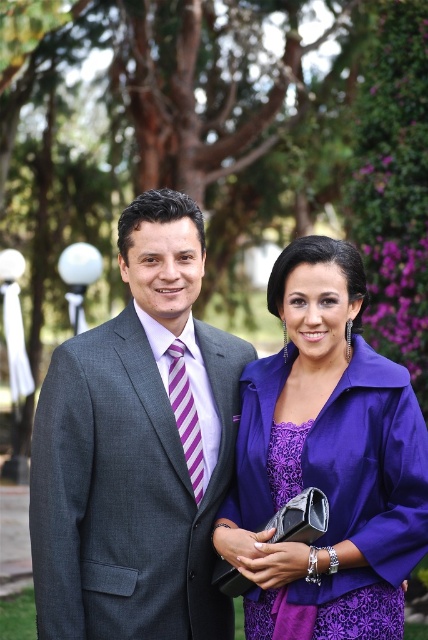
You are a photographer setting up for a formal event. You notice two items in the scene that need adjustment. The matte gray suit at center and the purple striped tie at center. According to the spatial arrangement, which item should you adjust first to ensure proper alignment with the background? Please explain your reasoning based on their positions.

The matte gray suit at center should be adjusted first because it is positioned to the left of the purple striped tie at center. By addressing the leftmost item first, you can ensure proper alignment from left to right, maintaining a balanced composition with the background.

Consider the image. You are a photographer trying to capture a closeup of the two points in the image. Which point, point [165,230] or point [258,627], is closer to your camera lens?

Point [165,230] is closer to the camera lens because it is further to the viewer than point [258,627].

You are a photographer setting up for a formal outdoor event in the garden. You need to ensure that the matte gray suit at center and the purple striped tie at center are both visible in the frame. Based on their positions, which one should you focus on first to capture both in the shot?

The matte gray suit at center is located above the purple striped tie at center, so focusing on the matte gray suit at center first will ensure both are in the frame as the tie is positioned below it.